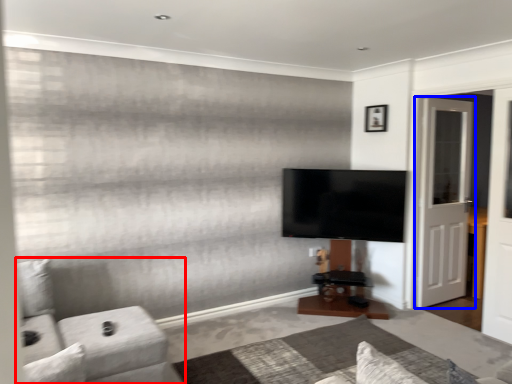
Question: Which point is further to the camera, furniture (highlighted by a red box) or door (highlighted by a blue box)?

Choices:
 (A) furniture
 (B) door

Answer: (B)